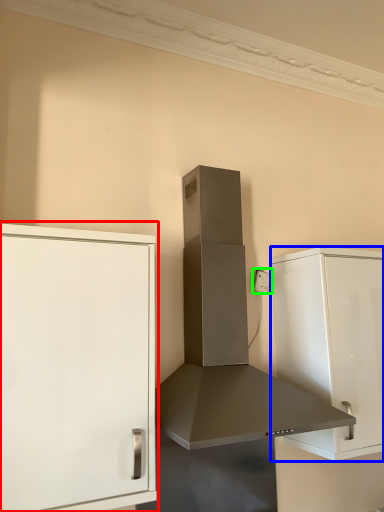
Question: Based on their relative distances, which object is farther from cabinetry (highlighted by a red box)? Choose from cabinetry (highlighted by a blue box) and electric outlet (highlighted by a green box).

Choices:
 (A) cabinetry
 (B) electric outlet

Answer: (B)